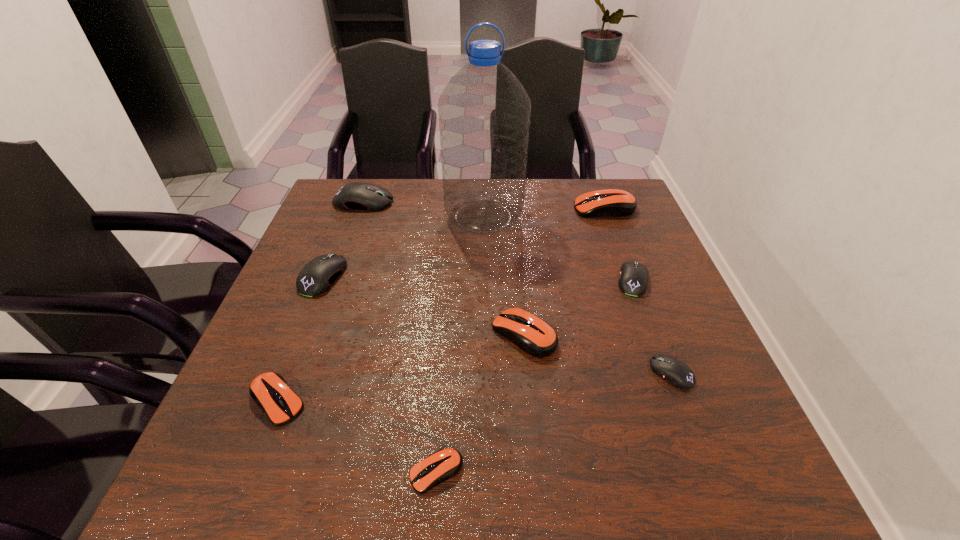
Select which orange computer mouse appears as the fourth closest to the blue water jug. Please provide its 2D coordinates. Your answer should be formatted as a tuple, i.e. [(x, y)], where the tuple contains the x and y coordinates of a point satisfying the conditions above.

[(445, 463)]

Locate an element on the screen. Image resolution: width=960 pixels, height=540 pixels. vacant region that satisfies the following two spatial constraints: 1. on the back side of the biggest orange computer mouse; 2. on the right side of the second smallest orange computer mouse is located at coordinates (352, 209).

Identify the location of free space that satisfies the following two spatial constraints: 1. on the back side of the third farthest orange computer mouse; 2. on the right side of the water jug. click(x=349, y=217).

You are a GUI agent. You are given a task and a screenshot of the screen. Output one action in this format:
    pyautogui.click(x=<x>, y=<y>)
    Task: Click on the free location that satisfies the following two spatial constraints: 1. on the front side of the third biggest black computer equipment; 2. on the left side of the farthest black computer equipment
    This screenshot has height=540, width=960.
    Given the screenshot: What is the action you would take?
    pyautogui.click(x=335, y=280)